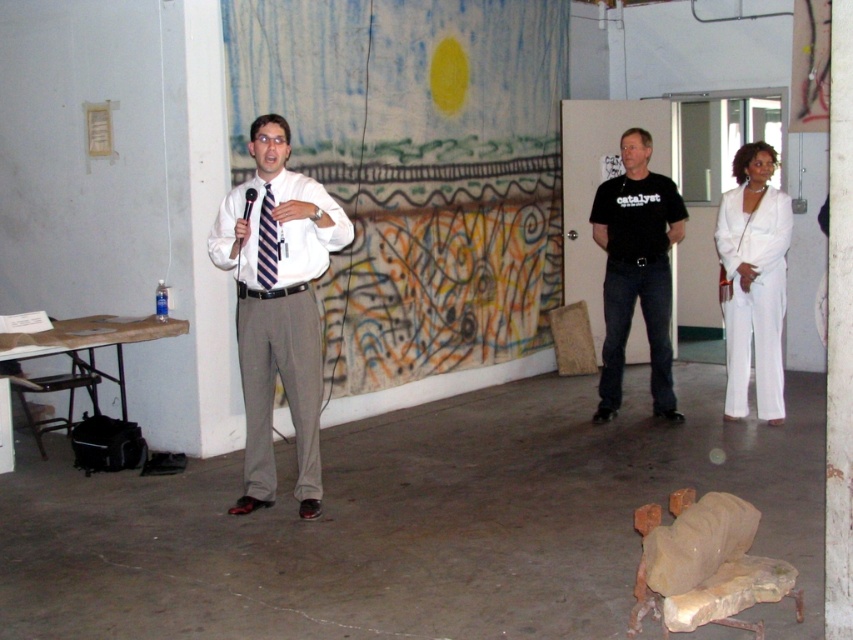
Consider the image. Is white satin pantsuit at right in front of white smooth dress shirt at center?

No, it is behind white smooth dress shirt at center.

Is white satin pantsuit at right shorter than white smooth dress shirt at center?

No, white satin pantsuit at right is not shorter than white smooth dress shirt at center.

Is point (763, 204) positioned in front of point (299, 268)?

That is False.

Locate an element on the screen. white satin pantsuit at right is located at coordinates (753, 282).

Can you confirm if black cotton t-shirt at center is positioned above white smooth dress shirt at center?

Actually, black cotton t-shirt at center is below white smooth dress shirt at center.

Does black cotton t-shirt at center have a greater width compared to white smooth dress shirt at center?

No.

I want to click on black cotton t-shirt at center, so click(x=636, y=269).

This screenshot has width=853, height=640. Find the location of `black cotton t-shirt at center`. black cotton t-shirt at center is located at coordinates (636, 269).

Is point (653, 333) positioned in front of point (770, 200)?

No, (653, 333) is further to viewer.

Is black cotton t-shirt at center to the right of white satin pantsuit at right from the viewer's perspective?

Incorrect, black cotton t-shirt at center is not on the right side of white satin pantsuit at right.

Is point (621, 236) closer to camera compared to point (772, 420)?

No, it is not.

Find the location of a particular element. black cotton t-shirt at center is located at coordinates (636, 269).